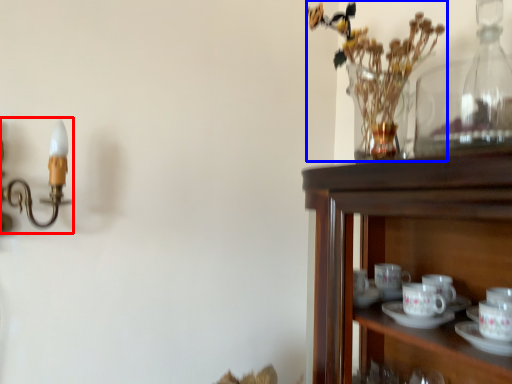
Question: Which point is closer to the camera, candle holder (highlighted by a red box) or floral arrangement (highlighted by a blue box)?

Choices:
 (A) candle holder
 (B) floral arrangement

Answer: (A)